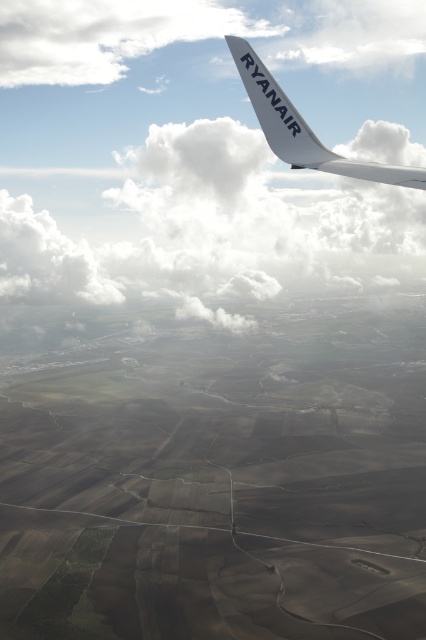
Which of these two, white fluffy cloud at upper center or white matte ryanair winglet at upper right, stands shorter?

Standing shorter between the two is white matte ryanair winglet at upper right.

Is white fluffy cloud at upper center taller than white matte ryanair winglet at upper right?

Yes.

Who is more distant from viewer, (161, 285) or (307, 164)?

The point (161, 285) is more distant.

Locate an element on the screen. The height and width of the screenshot is (640, 426). white fluffy cloud at upper center is located at coordinates (210, 228).

Does point (374, 260) come in front of point (298, 163)?

No, it is behind (298, 163).

Which is above, white fluffy cloud at upper center or white matte wing at upper center?

white fluffy cloud at upper center is above.

Where is `white fluffy cloud at upper center`? white fluffy cloud at upper center is located at coordinates (210, 228).

Where is `white fluffy cloud at upper center`? white fluffy cloud at upper center is located at coordinates (210, 228).

Does white matte ryanair winglet at upper right lie behind white matte wing at upper center?

No, white matte ryanair winglet at upper right is in front of white matte wing at upper center.

Is white matte ryanair winglet at upper right wider than white matte wing at upper center?

Yes.

The height and width of the screenshot is (640, 426). Find the location of `white matte ryanair winglet at upper right`. white matte ryanair winglet at upper right is located at coordinates (304, 128).